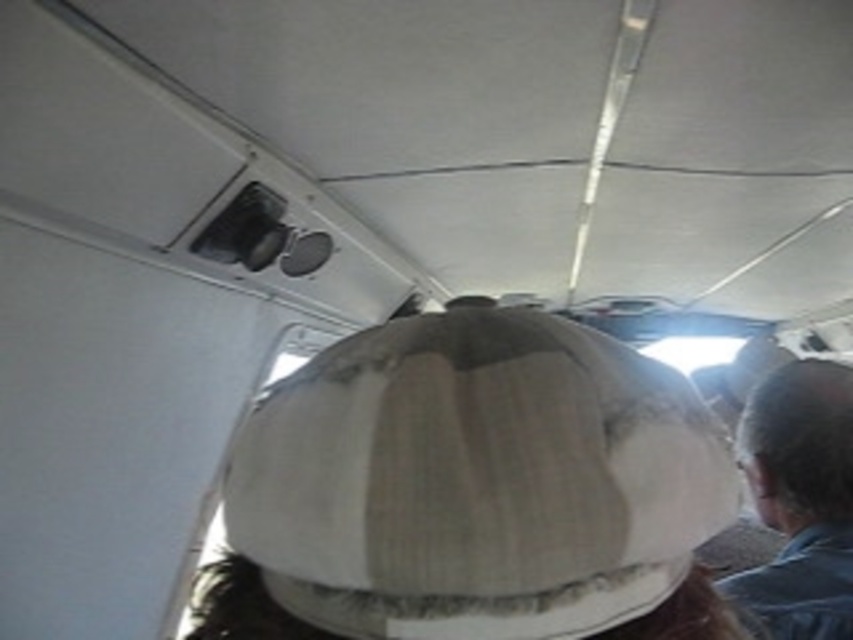
Question: Does fuzzy beige baseball hat at center have a larger size compared to gray fabric hat at upper right?

Choices:
 (A) yes
 (B) no

Answer: (B)

Question: Does fuzzy beige baseball hat at center appear on the right side of gray fabric hat at upper right?

Choices:
 (A) no
 (B) yes

Answer: (A)

Question: Can you confirm if fuzzy beige baseball hat at center is positioned below gray fabric hat at upper right?

Choices:
 (A) no
 (B) yes

Answer: (A)